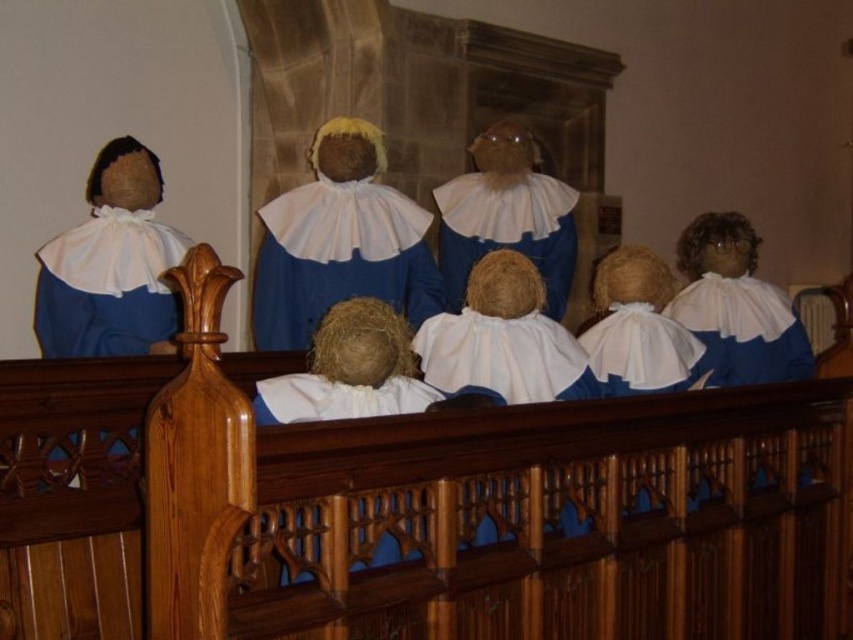
You are a tailor measuring garments for a costume fitting. You have a white cotton doll at center and a matte blue dress at center. Which garment has a greater width?

The matte blue dress at center has a greater width than the white cotton doll at center.

You are standing in the church scene and want to move from the point at coordinates point (387, 205) to point (548, 209). Will you be moving forward or backward relative to the scene?

Since point (387, 205) is in front of point (548, 209), moving from the former to the latter would mean moving backward in the scene.

You are a photographer setting up a photo shoot in a church. You have a matte blue dress at center and a white cotton doll at center in the scene. Which object should you adjust to ensure both are visible in the frame without cropping?

The matte blue dress at center is much taller than the white cotton doll at center. To ensure both are visible without cropping, you should lower the camera angle slightly to accommodate the height of the matte blue dress at center while keeping the white cotton doll at center in view.